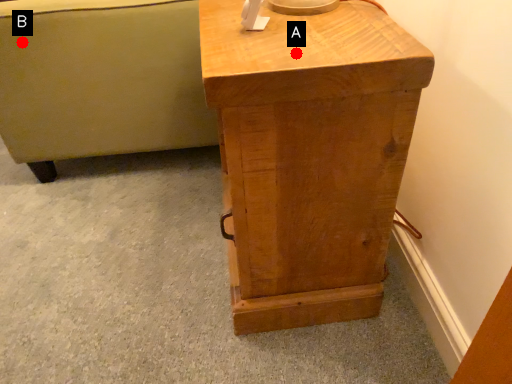
Question: Two points are circled on the image, labeled by A and B beside each circle. Which of the following is the farthest from the observer?

Choices:
 (A) A is further
 (B) B is further

Answer: (B)